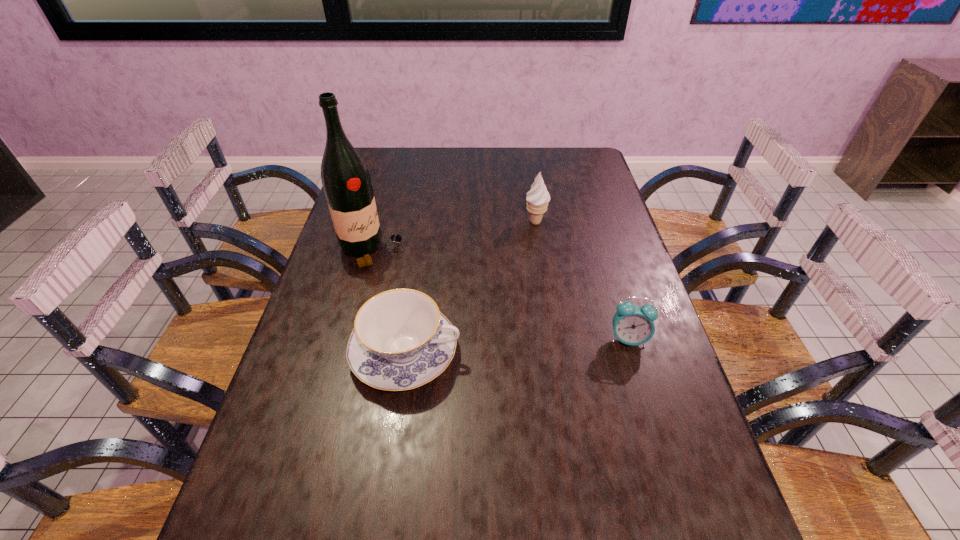
You are a GUI agent. You are given a task and a screenshot of the screen. Output one action in this format:
    pyautogui.click(x=<x>, y=<y>)
    Task: Click on the free point between the chinaware and the rightmost object
    
    Given the screenshot: What is the action you would take?
    pyautogui.click(x=516, y=346)

This screenshot has height=540, width=960. In order to click on object that is the closest one to the rightmost object in this screenshot , I will do `click(400, 341)`.

Identify which object is the second closest to the alarm clock. Please provide its 2D coordinates. Your answer should be formatted as a tuple, i.e. [(x, y)], where the tuple contains the x and y coordinates of a point satisfying the conditions above.

[(538, 197)]

This screenshot has width=960, height=540. I want to click on vacant space that satisfies the following two spatial constraints: 1. on the back side of the wine bottle; 2. on the left side of the farthest object, so click(x=379, y=222).